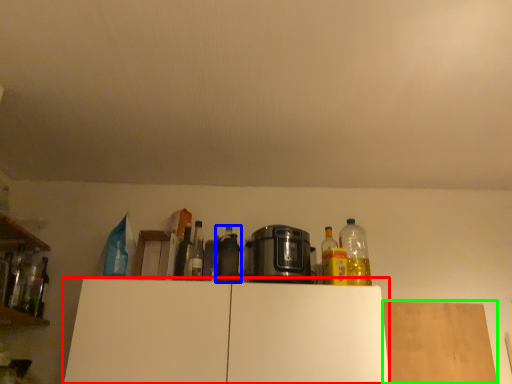
Question: Based on their relative distances, which object is nearer to cabinetry (highlighted by a red box)? Choose from bottle (highlighted by a blue box) and plywood (highlighted by a green box).

Choices:
 (A) bottle
 (B) plywood

Answer: (A)